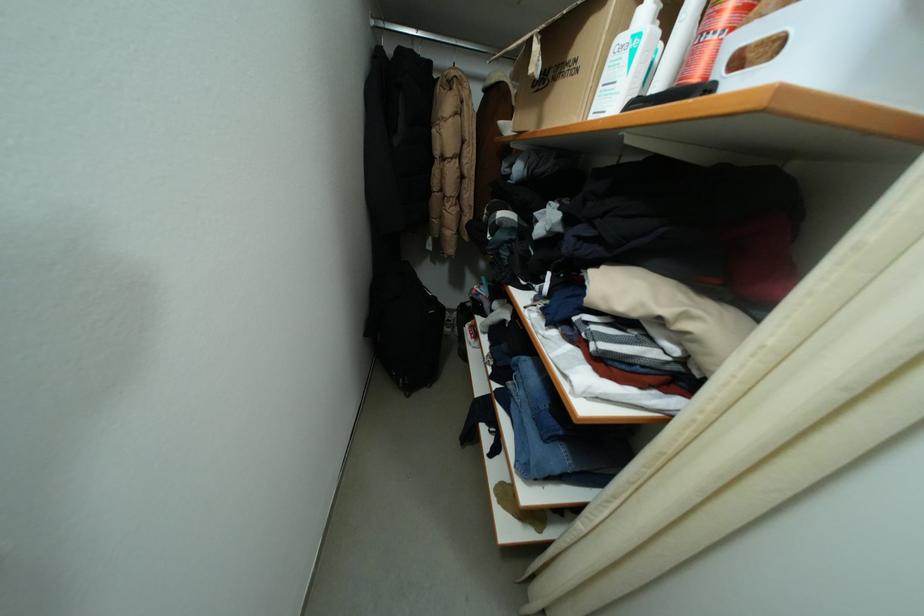
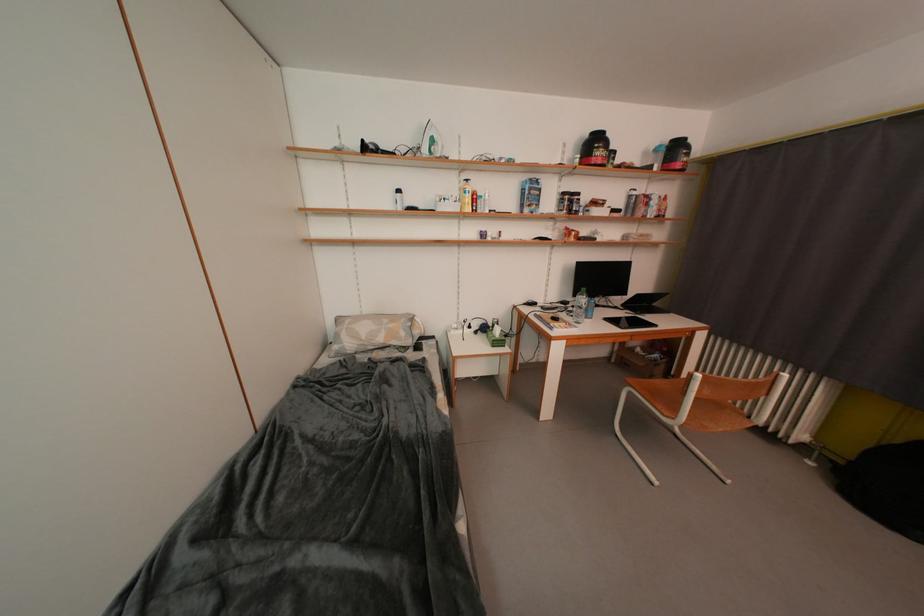
Question: What movement of the cameraman would produce the second image?

Choices:
 (A) Left
 (B) Right
 (C) Forward
 (D) Backward

Answer: (B)